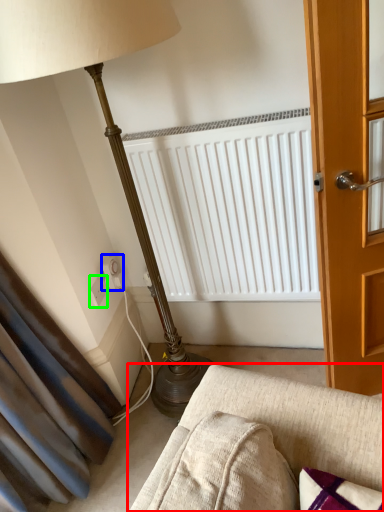
Question: Which object is the closest to the studio couch (highlighted by a red box)? Choose among these: electric outlet (highlighted by a blue box) or electric outlet (highlighted by a green box).

Choices:
 (A) electric outlet
 (B) electric outlet

Answer: (B)